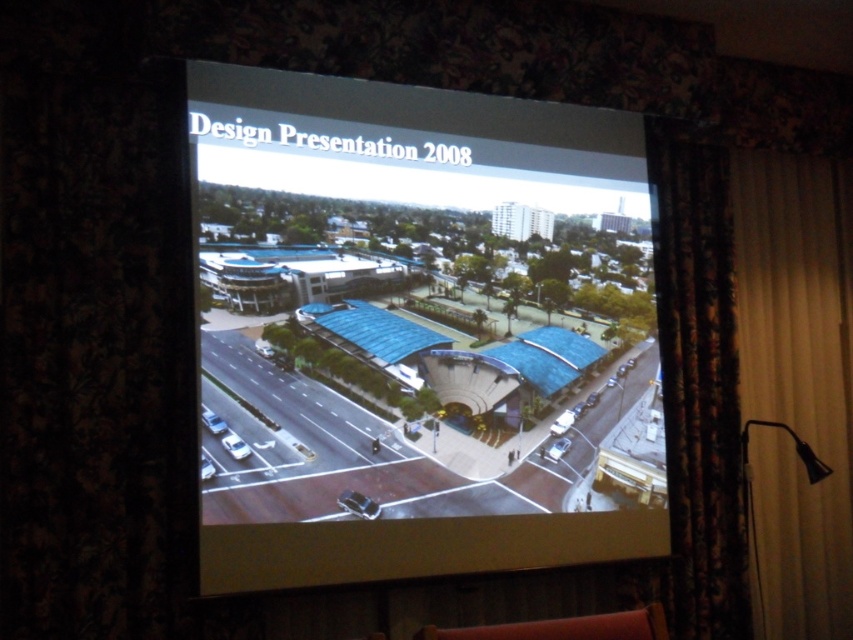
Is white glossy car at lower left smaller than shiny silver car at center?

Actually, white glossy car at lower left might be larger than shiny silver car at center.

Does point (212, 413) come closer to viewer compared to point (202, 480)?

No, (212, 413) is further to viewer.

Which is behind, point (216, 420) or point (210, 465)?

The point (216, 420) is more distant.

The width and height of the screenshot is (853, 640). I want to click on white glossy car at lower left, so click(x=213, y=420).

Does metallic silver car at lower left appear under white glossy car at lower left?

Correct, metallic silver car at lower left is located below white glossy car at lower left.

Who is shorter, metallic silver car at lower left or white glossy car at lower left?

metallic silver car at lower left

Identify the location of metallic silver car at lower left. The width and height of the screenshot is (853, 640). (235, 445).

Is dark floral fabric curtain at right above shiny silver car at center?

Correct, dark floral fabric curtain at right is located above shiny silver car at center.

Measure the distance between dark floral fabric curtain at right and shiny silver car at center.

A distance of 2.24 meters exists between dark floral fabric curtain at right and shiny silver car at center.

Does point (706, 212) come farther from viewer compared to point (202, 460)?

Yes, it is.

The height and width of the screenshot is (640, 853). Find the location of `dark floral fabric curtain at right`. dark floral fabric curtain at right is located at coordinates (698, 381).